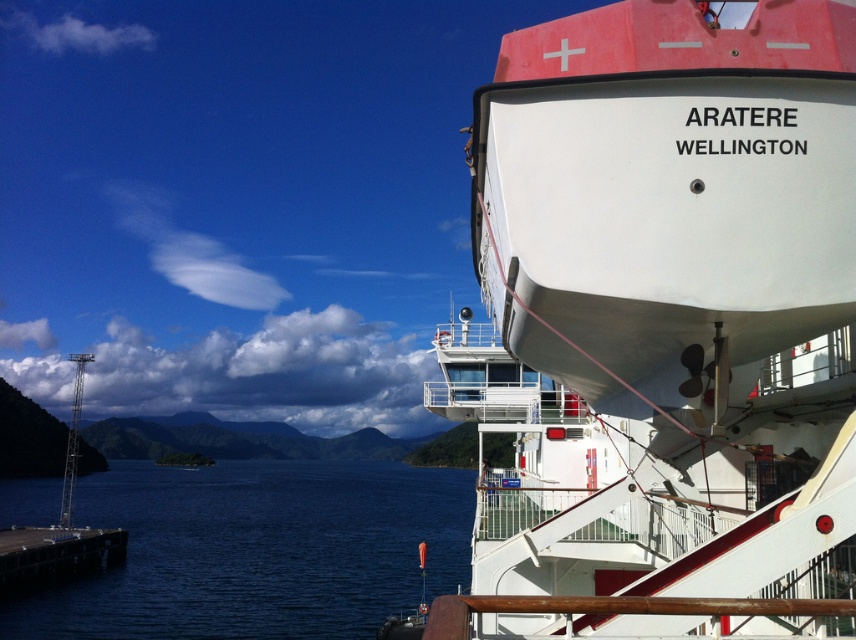
Question: Does white matte ship at upper right have a greater width compared to blue water at lower left?

Choices:
 (A) no
 (B) yes

Answer: (A)

Question: Which of the following is the farthest from the observer?

Choices:
 (A) (336, 612)
 (B) (562, 442)

Answer: (A)

Question: Which point is farther from the camera taking this photo?

Choices:
 (A) (220, 611)
 (B) (643, 273)

Answer: (A)

Question: Does white matte ship at upper right have a greater width compared to blue water at lower left?

Choices:
 (A) no
 (B) yes

Answer: (A)

Question: Which object is closer to the camera taking this photo?

Choices:
 (A) blue water at lower left
 (B) white matte ship at upper right

Answer: (B)

Question: Does white matte ship at upper right appear on the left side of blue water at lower left?

Choices:
 (A) no
 (B) yes

Answer: (A)